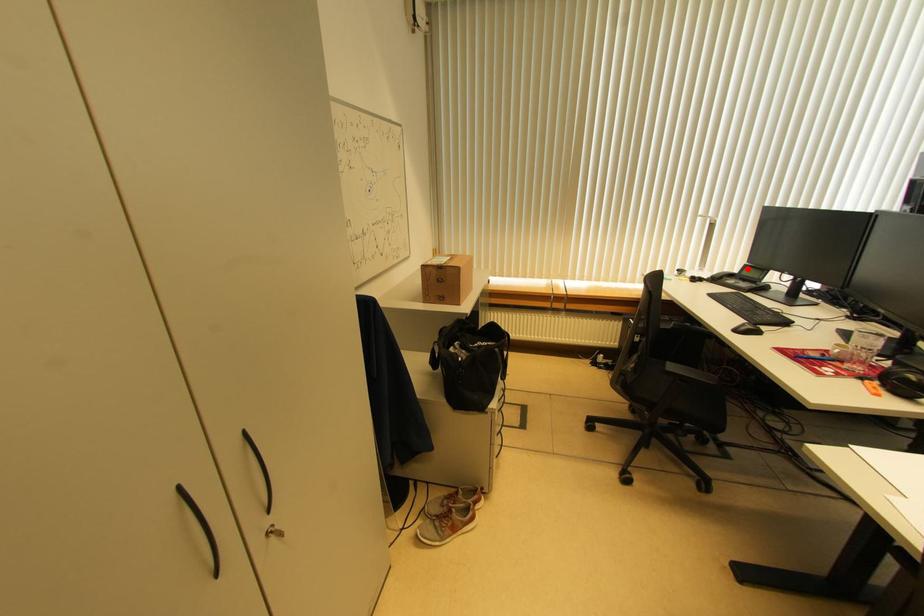
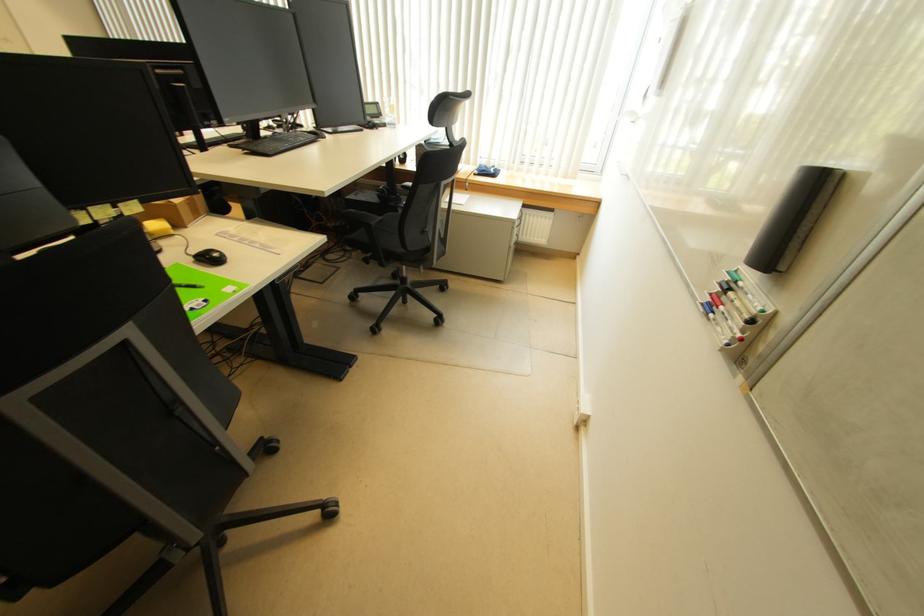
Question: I am providing you with two images of the same scene from different viewpoints. A red point is marked on the first image. Is the red point's position out of view in image 2?

Choices:
 (A) Yes
 (B) No

Answer: (A)